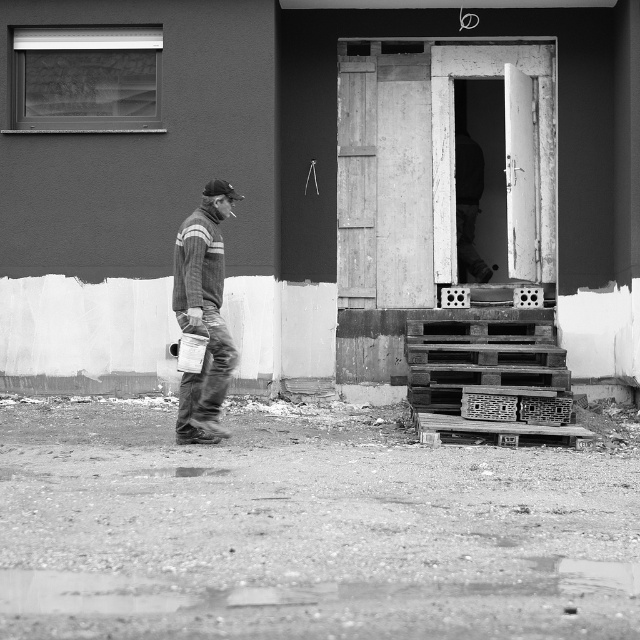
Does point (182, 291) come in front of point (557, 413)?

Yes, point (182, 291) is in front of point (557, 413).

Does striped fleece jacket at left appear over wooden crate at lower right?

Indeed, striped fleece jacket at left is positioned over wooden crate at lower right.

Is point (230, 189) closer to viewer compared to point (557, 403)?

Yes, point (230, 189) is in front of point (557, 403).

This screenshot has height=640, width=640. In order to click on striped fleece jacket at left in this screenshot , I will do `click(204, 314)`.

Consider the image. Who is more distant from viewer, (492, 401) or (554, 412)?

The point (492, 401) is behind.

Does rustic wooden crate at lower right appear under wooden crate at lower right?

Actually, rustic wooden crate at lower right is above wooden crate at lower right.

Is point (468, 406) positioned after point (525, 413)?

That is True.

The width and height of the screenshot is (640, 640). I want to click on rustic wooden crate at lower right, so click(488, 406).

Does wooden pallets at lower right have a lesser height compared to striped fleece jacket at left?

Correct, wooden pallets at lower right is not as tall as striped fleece jacket at left.

Can you confirm if wooden pallets at lower right is thinner than striped fleece jacket at left?

No, wooden pallets at lower right is not thinner than striped fleece jacket at left.

Where is `wooden pallets at lower right`? wooden pallets at lower right is located at coordinates (490, 376).